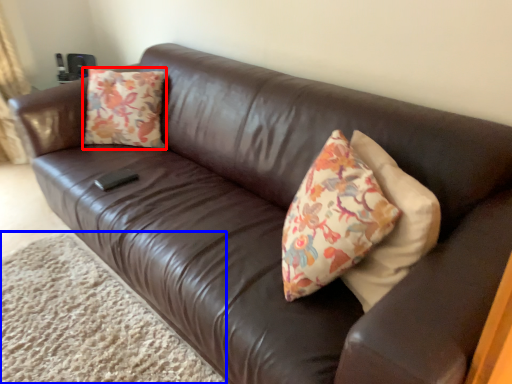
Question: Among these objects, which one is nearest to the camera, throw pillow (highlighted by a red box) or plain (highlighted by a blue box)?

Choices:
 (A) throw pillow
 (B) plain

Answer: (B)